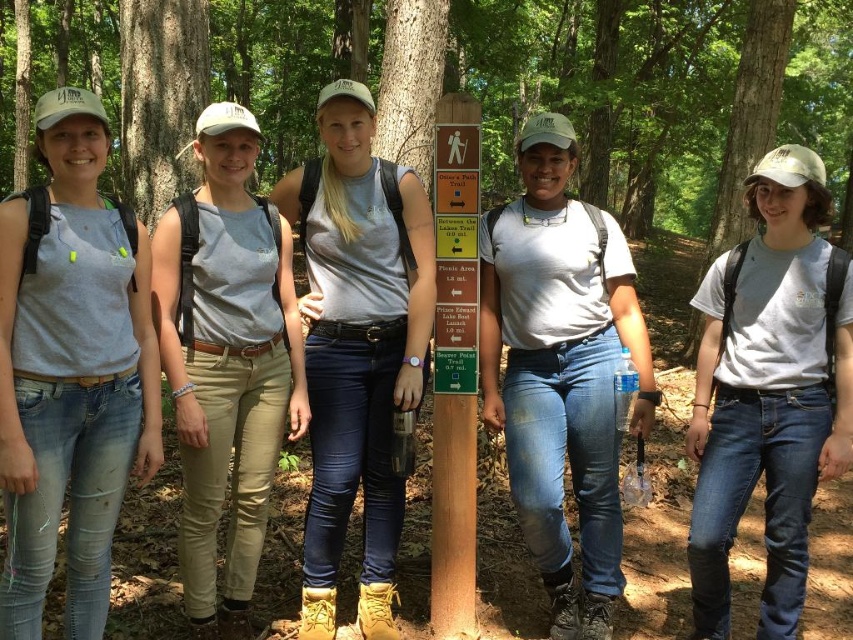
You are a photographer trying to capture a clear shot of the wooden signpost. You notice two people in the scene wearing the matte gray tank top at left and the light beige cotton pants at center. Which clothing item is more likely to cause a distraction due to its visibility against the natural background?

The matte gray tank top at left is thinner than the light beige cotton pants at center, so the light beige cotton pants at center might be more noticeable against the natural background, potentially causing more distraction.